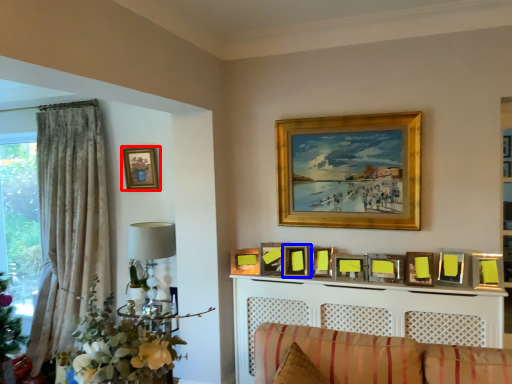
Question: Among these objects, which one is farthest to the camera, picture frame (highlighted by a red box) or picture frame (highlighted by a blue box)?

Choices:
 (A) picture frame
 (B) picture frame

Answer: (A)